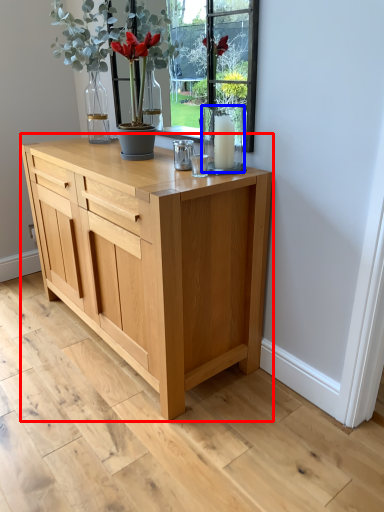
Question: Among these objects, which one is farthest to the camera, chest of drawers (highlighted by a red box) or glass vase (highlighted by a blue box)?

Choices:
 (A) chest of drawers
 (B) glass vase

Answer: (B)